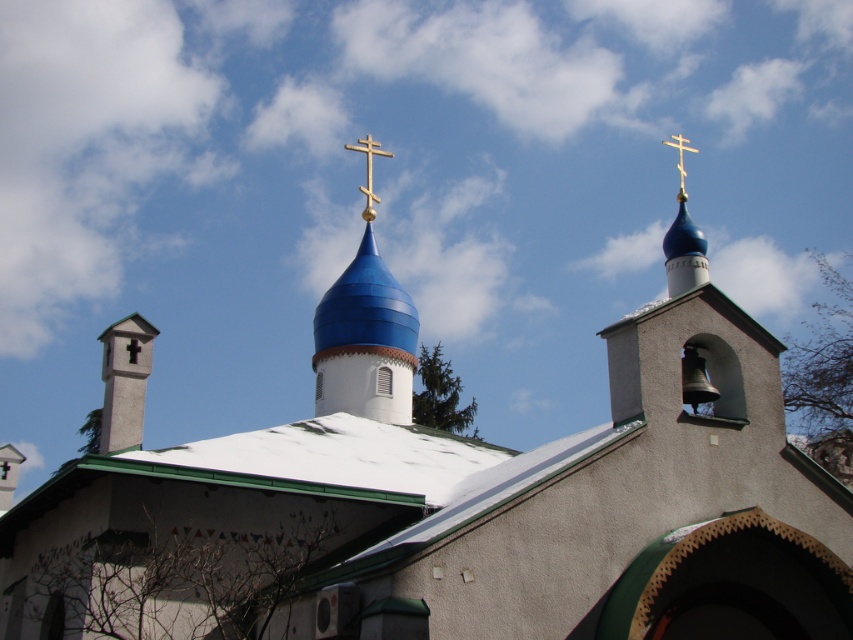
Question: Is gold metallic cross at upper center below gold metallic cross at upper right?

Choices:
 (A) no
 (B) yes

Answer: (B)

Question: Does gold metallic cross at upper center appear under gold metallic cross at upper right?

Choices:
 (A) yes
 (B) no

Answer: (A)

Question: Is gold metallic cross at upper center above gold metallic cross at upper right?

Choices:
 (A) no
 (B) yes

Answer: (A)

Question: Which of the following is the farthest from the observer?

Choices:
 (A) (665, 141)
 (B) (366, 144)

Answer: (A)